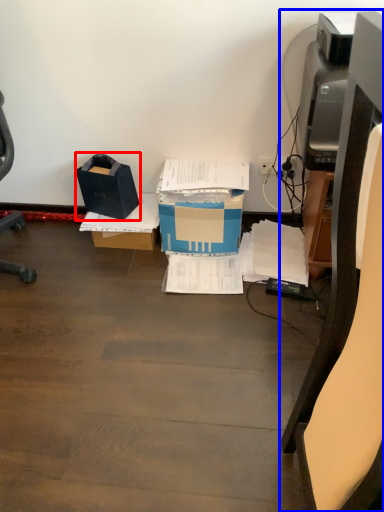
Question: Among these objects, which one is farthest to the camera, box (highlighted by a red box) or furniture (highlighted by a blue box)?

Choices:
 (A) box
 (B) furniture

Answer: (A)